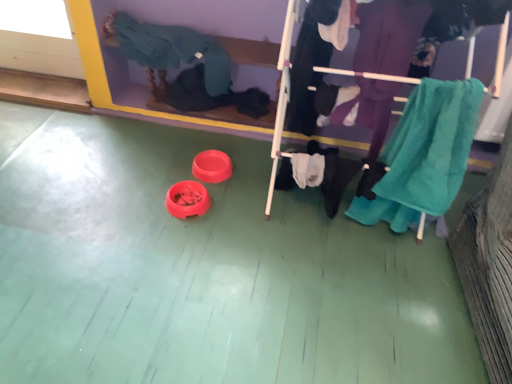
I want to click on free space to the left of teal towel at right, the first clothing positioned from the right, so click(x=325, y=263).